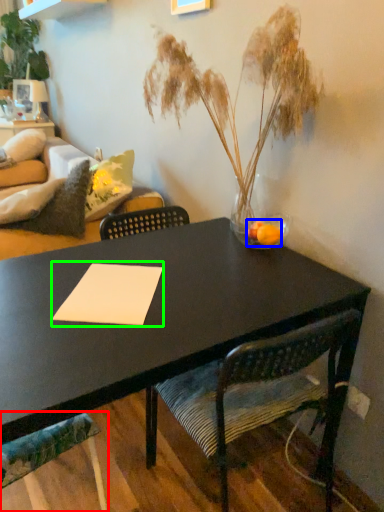
Question: Estimate the real-world distances between objects in this image. Which object is closer to chair (highlighted by a red box), flower (highlighted by a blue box) or notepad (highlighted by a green box)?

Choices:
 (A) flower
 (B) notepad

Answer: (B)